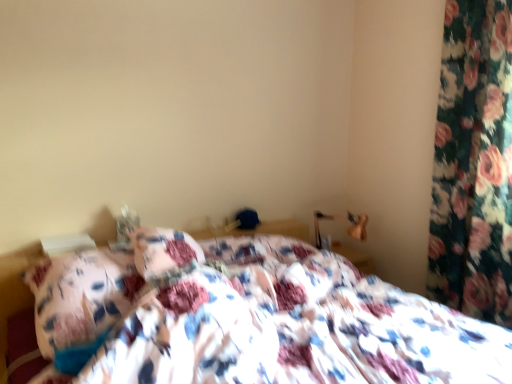
Question: Is point (53, 372) closer or farther from the camera than point (449, 147)?

Choices:
 (A) closer
 (B) farther

Answer: (A)

Question: From a real-world perspective, is floral fabric bed at center above or below floral fabric curtain at right?

Choices:
 (A) above
 (B) below

Answer: (B)

Question: Is floral fabric bed at center wider or thinner than floral fabric curtain at right?

Choices:
 (A) thin
 (B) wide

Answer: (B)

Question: Choose the correct answer: Is floral fabric curtain at right inside floral fabric bed at center or outside it?

Choices:
 (A) outside
 (B) inside

Answer: (A)

Question: Relative to floral fabric bed at center, is floral fabric curtain at right in front or behind?

Choices:
 (A) front
 (B) behind

Answer: (B)

Question: From a real-world perspective, is floral fabric curtain at right positioned above or below floral fabric bed at center?

Choices:
 (A) below
 (B) above

Answer: (B)

Question: Is floral fabric curtain at right wider or thinner than floral fabric bed at center?

Choices:
 (A) wide
 (B) thin

Answer: (B)